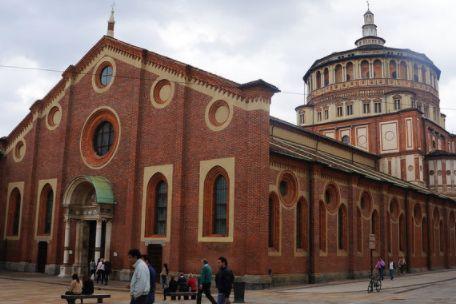
Where is `frame`? This screenshot has width=456, height=304. frame is located at coordinates (219, 184).